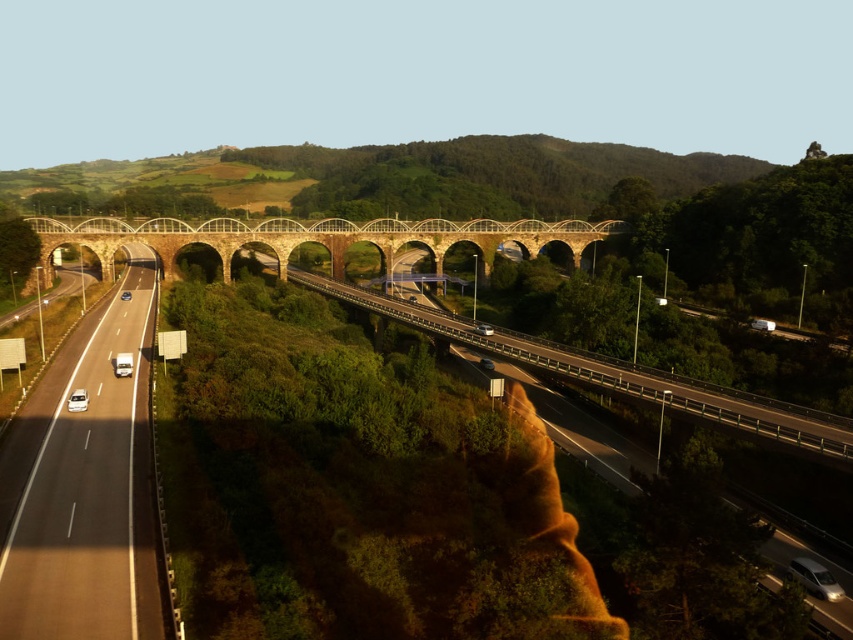
Who is lower down, smooth asphalt highway at left or stone arch bridge at center?

smooth asphalt highway at left is lower down.

Between smooth asphalt highway at left and stone arch bridge at center, which one appears on the right side from the viewer's perspective?

From the viewer's perspective, stone arch bridge at center appears more on the right side.

The image size is (853, 640). Describe the element at coordinates (86, 486) in the screenshot. I see `smooth asphalt highway at left` at that location.

Identify the location of smooth asphalt highway at left. Image resolution: width=853 pixels, height=640 pixels. (86, 486).

Between point (56, 532) and point (119, 355), which one is positioned behind?

Point (119, 355)

Who is higher up, smooth asphalt highway at left or white glossy car at center-left?

Result: Positioned higher is white glossy car at center-left.

Is point (96, 435) less distant than point (120, 371)?

Yes, point (96, 435) is in front of point (120, 371).

Where is `smooth asphalt highway at left`? smooth asphalt highway at left is located at coordinates (86, 486).

Looking at this image, does white glossy car at center-left have a lesser height compared to white glossy car at lower left?

Incorrect, white glossy car at center-left's height does not fall short of white glossy car at lower left's.

Is white glossy car at center-left smaller than white glossy car at lower left?

No, white glossy car at center-left is not smaller than white glossy car at lower left.

Find the location of a particular element. white glossy car at center-left is located at coordinates (123, 364).